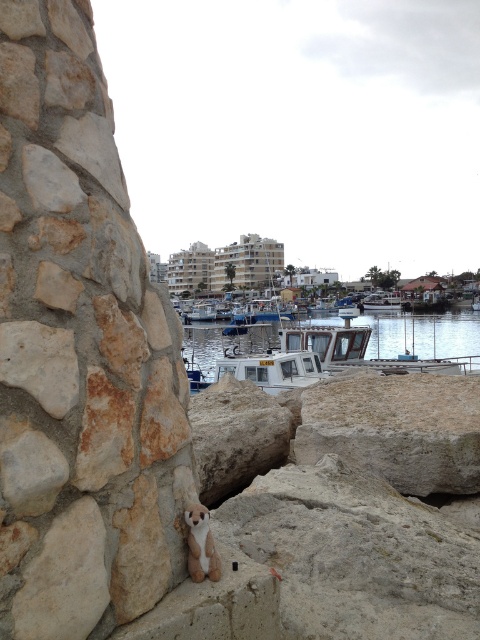
Question: Which object is farther from the camera taking this photo?

Choices:
 (A) white plastic boat at center
 (B) white fur dog at lower center
 (C) white glossy boat at center
 (D) clear water at center

Answer: (A)

Question: Is white fur dog at lower center smaller than white glossy boat at center?

Choices:
 (A) yes
 (B) no

Answer: (A)

Question: Which object is farther from the camera taking this photo?

Choices:
 (A) white glossy boat at center
 (B) clear water at center
 (C) beige stone wall at lower left

Answer: (A)

Question: Does clear water at center have a greater width compared to white glossy boat at center?

Choices:
 (A) no
 (B) yes

Answer: (B)

Question: Which point is closer to the camera taking this photo?

Choices:
 (A) (206, 308)
 (B) (393, 308)
 (C) (322, 346)
 (D) (120, 614)

Answer: (D)

Question: Is clear water at center wider than white plastic boat at center?

Choices:
 (A) yes
 (B) no

Answer: (A)